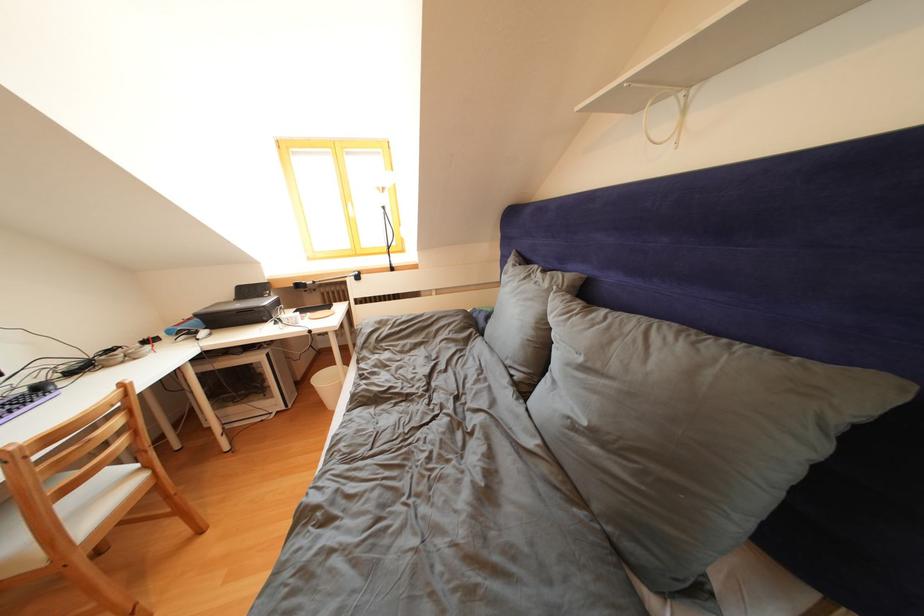
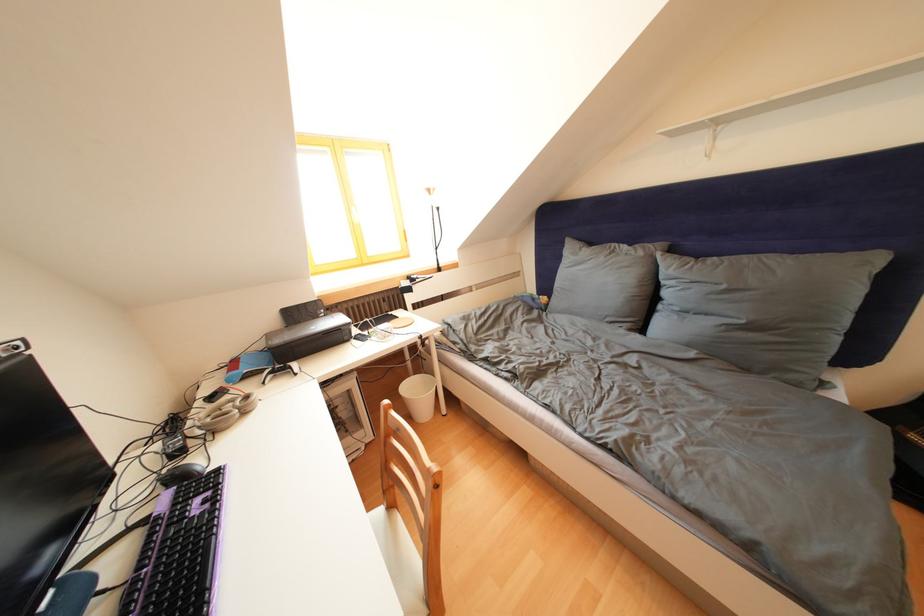
Find the pixel in the second image that matches point 269,301 in the first image.

(323, 322)